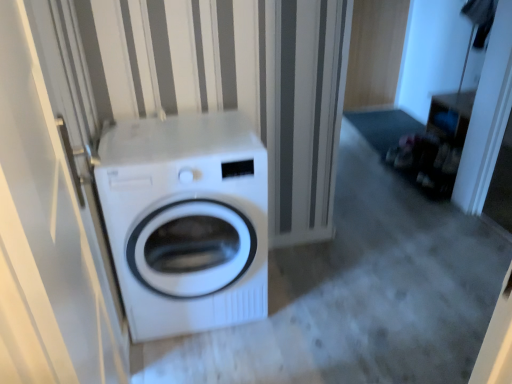
Question: Is white glossy washing machine at center in front of or behind white glossy door at left in the image?

Choices:
 (A) behind
 (B) front

Answer: (A)

Question: Looking at their shapes, would you say white glossy washing machine at center is wider or thinner than white glossy door at left?

Choices:
 (A) thin
 (B) wide

Answer: (B)

Question: Is point (156, 157) closer or farther from the camera than point (12, 221)?

Choices:
 (A) closer
 (B) farther

Answer: (B)

Question: Is white glossy door at left in front of or behind white glossy washing machine at center in the image?

Choices:
 (A) front
 (B) behind

Answer: (A)

Question: Considering the positions of white glossy door at left and white glossy washing machine at center in the image, is white glossy door at left wider or thinner than white glossy washing machine at center?

Choices:
 (A) wide
 (B) thin

Answer: (B)

Question: Is point (48, 221) closer or farther from the camera than point (118, 244)?

Choices:
 (A) farther
 (B) closer

Answer: (B)

Question: Based on their sizes in the image, would you say white glossy door at left is bigger or smaller than white glossy washing machine at center?

Choices:
 (A) big
 (B) small

Answer: (B)